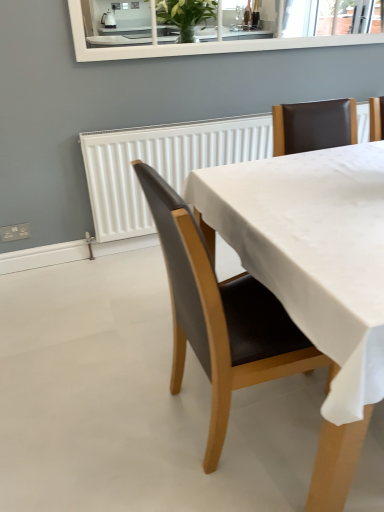
What are the coordinates of `brown leather chair at center` in the screenshot? It's located at (220, 315).

What do you see at coordinates (220, 315) in the screenshot? This screenshot has width=384, height=512. I see `brown leather chair at center` at bounding box center [220, 315].

Identify the location of brown leather chair at center. This screenshot has height=512, width=384. (220, 315).